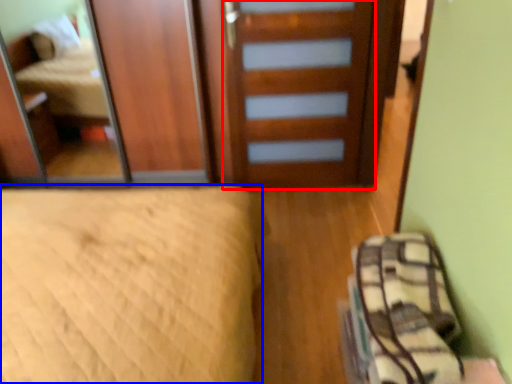
Question: Which point is further to the camera, door (highlighted by a red box) or bed (highlighted by a blue box)?

Choices:
 (A) door
 (B) bed

Answer: (A)